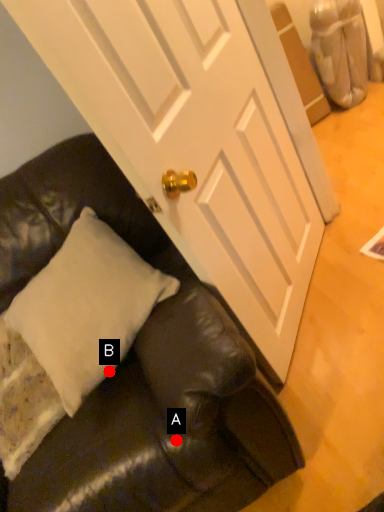
Question: Two points are circled on the image, labeled by A and B beside each circle. Which of the following is the closest to the observer?

Choices:
 (A) A is closer
 (B) B is closer

Answer: (A)